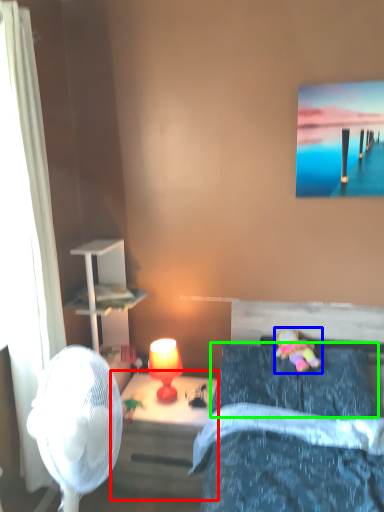
Question: Estimate the real-world distances between objects in this image. Which object is closer to nightstand (highlighted by a red box), toy (highlighted by a blue box) or pillow (highlighted by a green box)?

Choices:
 (A) toy
 (B) pillow

Answer: (B)